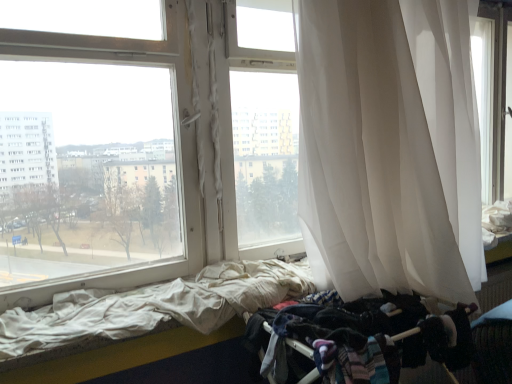
Where is `free spot above dark fabric baby carriage at lower right (from a real-world perspective)`? free spot above dark fabric baby carriage at lower right (from a real-world perspective) is located at coordinates (374, 309).